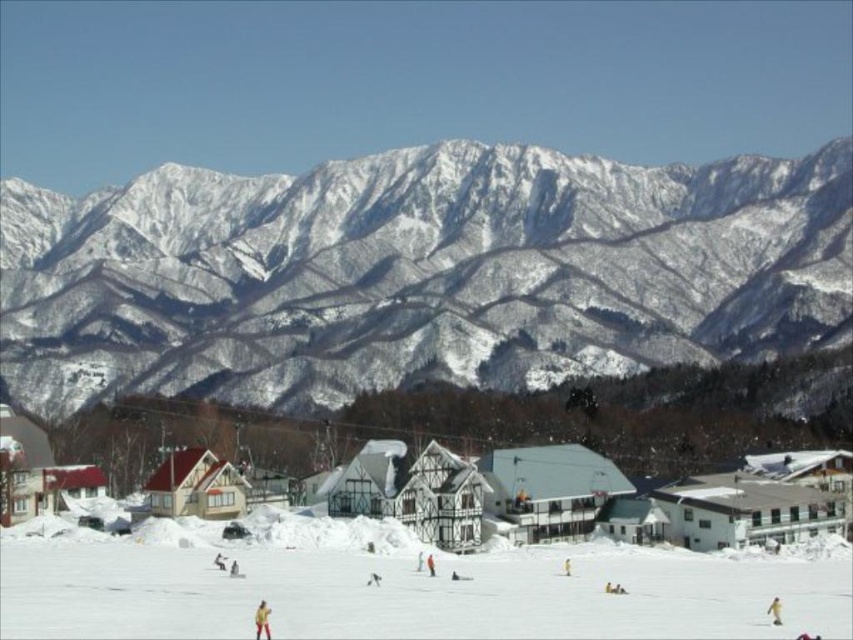
How distant is white snow-covered mountain range at upper center from white wooden houses at center?

white snow-covered mountain range at upper center is 294.68 meters away from white wooden houses at center.

Measure the distance between white snow-covered mountain range at upper center and camera.

The distance of white snow-covered mountain range at upper center from camera is 342.42 meters.

I want to click on white snow-covered mountain range at upper center, so click(416, 275).

Is white wooden houses at center in front of yellow snowsuit at center?

No, white wooden houses at center is behind yellow snowsuit at center.

Can you confirm if white wooden houses at center is positioned to the left of yellow snowsuit at center?

In fact, white wooden houses at center is to the right of yellow snowsuit at center.

Is point (843, 522) closer to viewer compared to point (219, 564)?

No.

The width and height of the screenshot is (853, 640). I want to click on white wooden houses at center, so click(570, 499).

Does white wooden houses at center have a lesser height compared to orange ski suit at center?

No.

Is white wooden houses at center bigger than orange ski suit at center?

Yes.

Where is `white wooden houses at center`? This screenshot has height=640, width=853. white wooden houses at center is located at coordinates (570, 499).